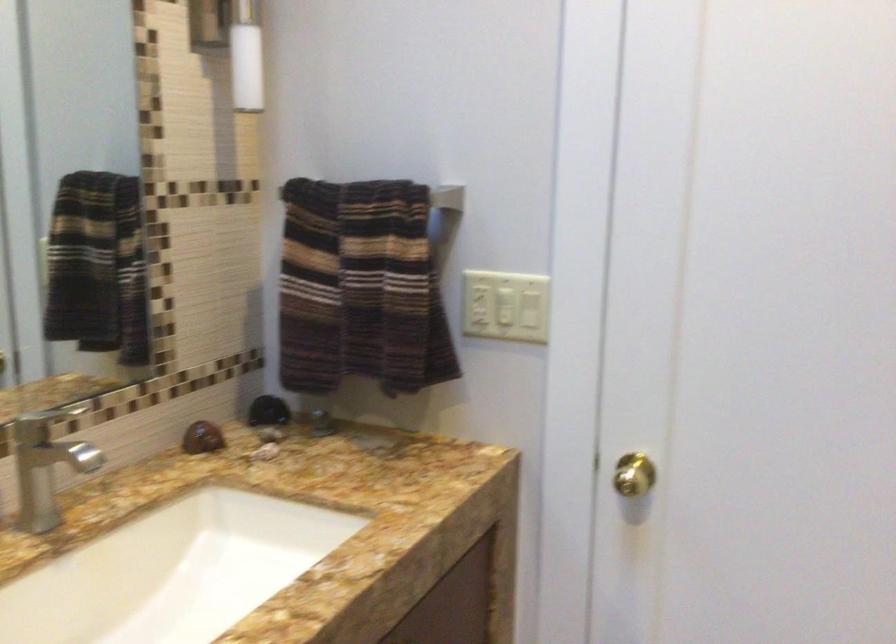
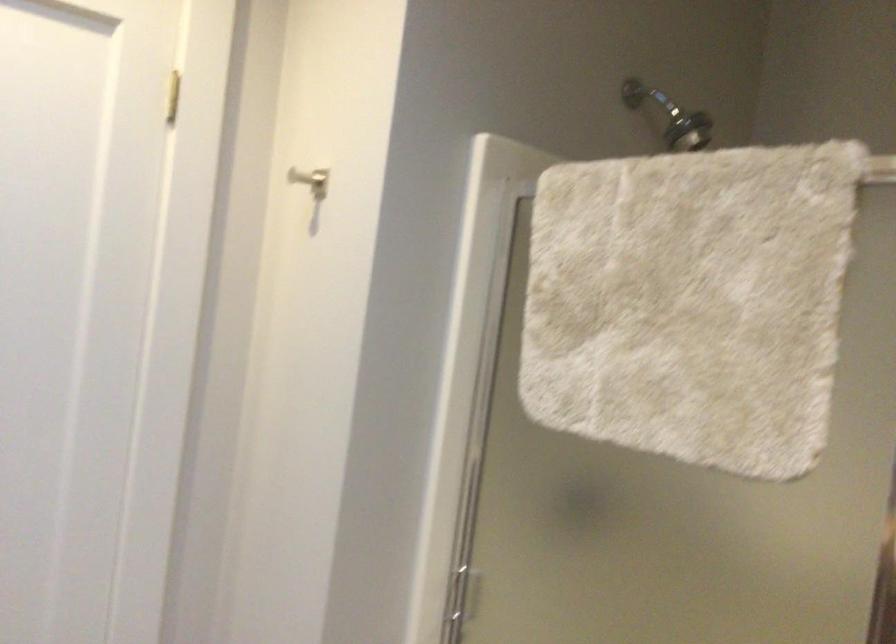
Question: The first image is from the beginning of the video and the second image is from the end. How did the camera likely rotate when shooting the video?

Choices:
 (A) Left
 (B) Right
 (C) Up
 (D) Down

Answer: (B)